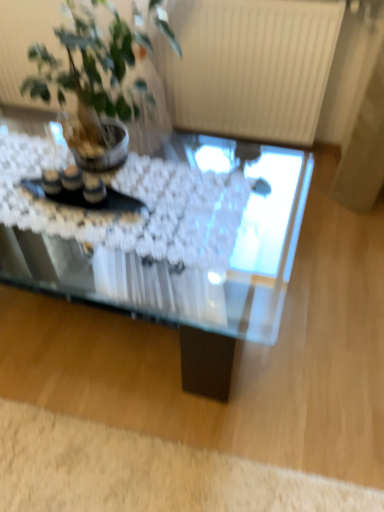
Identify the location of spots to the right of transparent glass coffee table at center. The width and height of the screenshot is (384, 512). (318, 293).